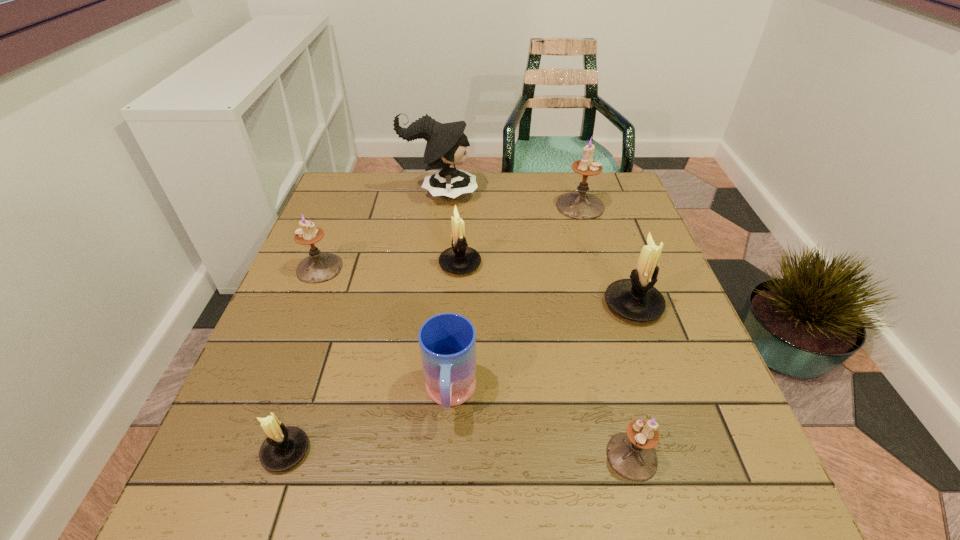
What are the coordinates of `vacant space at the far right corner of the desktop` in the screenshot? It's located at (628, 207).

The width and height of the screenshot is (960, 540). I want to click on vacant space at the near right corner, so click(x=719, y=519).

I want to click on free space between the rightmost white candle holder and the mug, so click(541, 350).

The image size is (960, 540). I want to click on vacant space that's between the mug and the smallest purple candle holder, so click(541, 426).

The image size is (960, 540). What are the coordinates of `empty space that is in between the farthest white candle holder and the farthest candle holder` in the screenshot? It's located at (520, 235).

What are the coordinates of `vacant area that lies between the nearest white candle holder and the second farthest purple candle holder` in the screenshot? It's located at (302, 360).

You are a GUI agent. You are given a task and a screenshot of the screen. Output one action in this format:
    pyautogui.click(x=<x>, y=<y>)
    Task: Click on the vacant area that lies between the smallest white candle holder and the smallest purple candle holder
    
    Given the screenshot: What is the action you would take?
    pyautogui.click(x=459, y=454)

The image size is (960, 540). In order to click on vacant area between the tallest object and the second farthest white candle holder in this screenshot , I will do `click(537, 249)`.

You are a GUI agent. You are given a task and a screenshot of the screen. Output one action in this format:
    pyautogui.click(x=<x>, y=<y>)
    Task: Click on the free spot between the doll and the fifth farthest object
    This screenshot has height=540, width=960.
    Given the screenshot: What is the action you would take?
    pyautogui.click(x=537, y=249)

Identify the location of free space between the farthest purple candle holder and the second white candle holder from right to left. (520, 235).